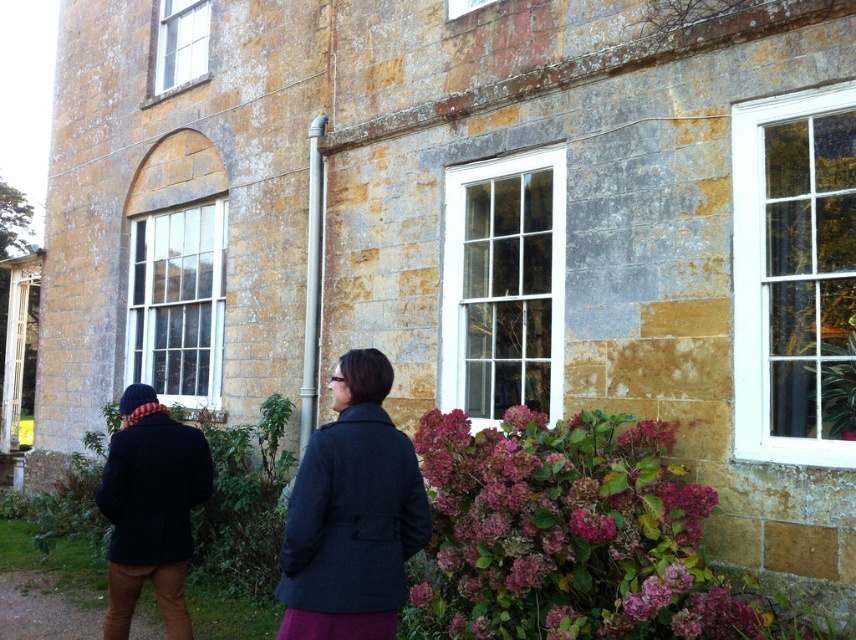
Question: Which object appears farthest from the camera in this image?

Choices:
 (A) clear glass window at center
 (B) white glass window at center
 (C) purple matte hydrangea at lower center

Answer: (A)

Question: Does white glass window at center have a smaller size compared to dark gray wool coat at center?

Choices:
 (A) no
 (B) yes

Answer: (A)

Question: Is white painted wood window at right in front of white glass window at center?

Choices:
 (A) yes
 (B) no

Answer: (A)

Question: Among these objects, which one is nearest to the camera?

Choices:
 (A) white glass window at center
 (B) dark gray wool coat at center
 (C) white painted wood window at right
 (D) clear glass window at upper left

Answer: (B)

Question: Can you confirm if white glass window at center is bigger than clear glass window at center?

Choices:
 (A) yes
 (B) no

Answer: (B)

Question: Which point is closer to the camera?

Choices:
 (A) (477, 182)
 (B) (318, 484)
 (C) (489, 580)
 (D) (205, 51)

Answer: (B)